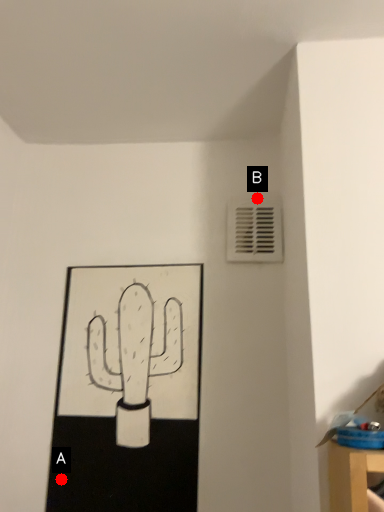
Question: Two points are circled on the image, labeled by A and B beside each circle. Which point is farther from the camera taking this photo?

Choices:
 (A) A is further
 (B) B is further

Answer: (B)